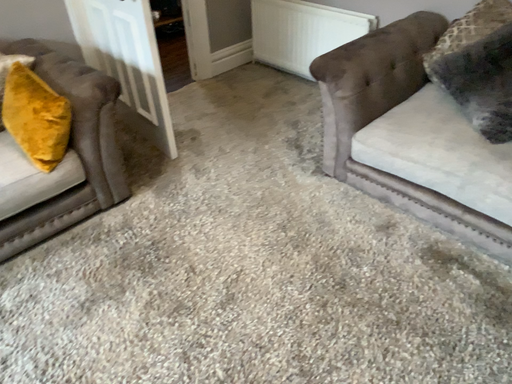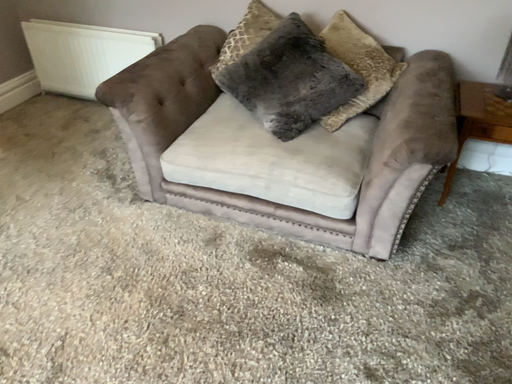
Question: Which way did the camera rotate in the video?

Choices:
 (A) rotated left
 (B) rotated right

Answer: (B)